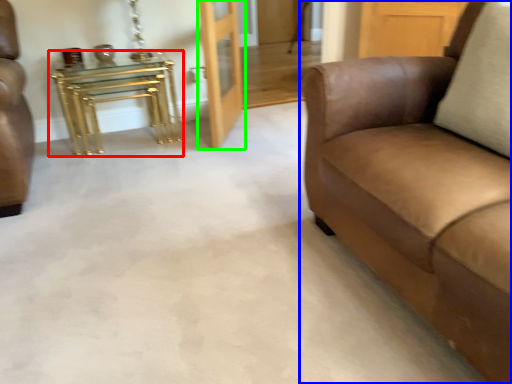
Question: Which object is positioned farthest from table (highlighted by a red box)? Select from studio couch (highlighted by a blue box) and door (highlighted by a green box).

Choices:
 (A) studio couch
 (B) door

Answer: (A)